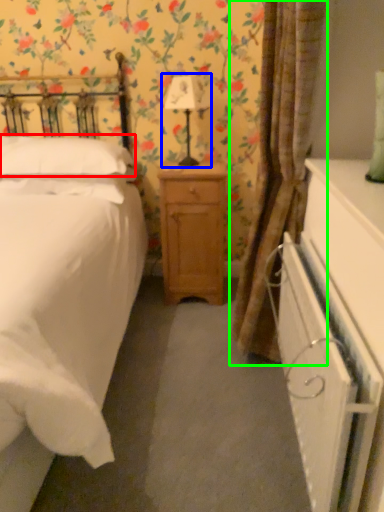
Question: Which is farther away from pillow (highlighted by a red box)? bedside lamp (highlighted by a blue box) or curtain (highlighted by a green box)?

Choices:
 (A) bedside lamp
 (B) curtain

Answer: (B)